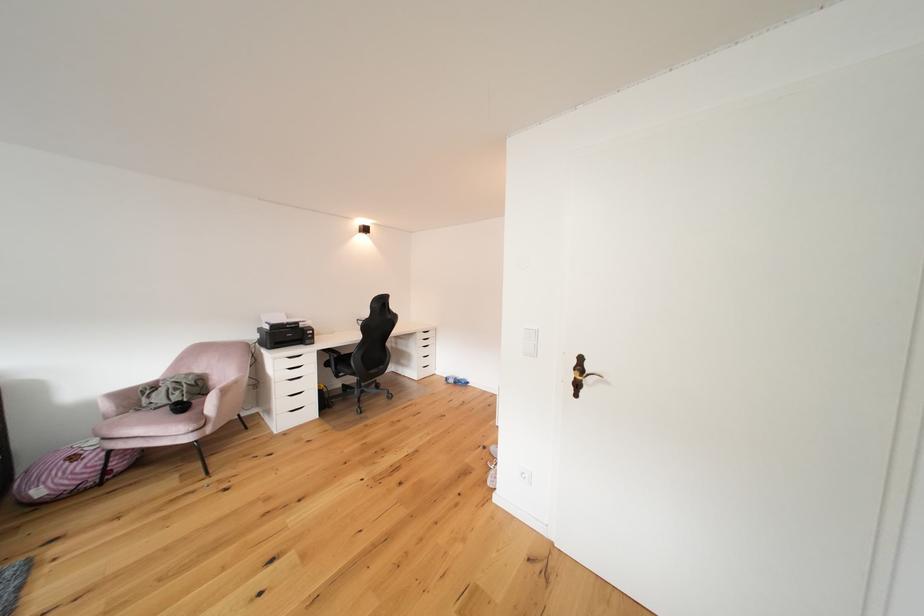
Locate an element on the screen. This screenshot has height=616, width=924. pink chair armrest is located at coordinates (225, 385).